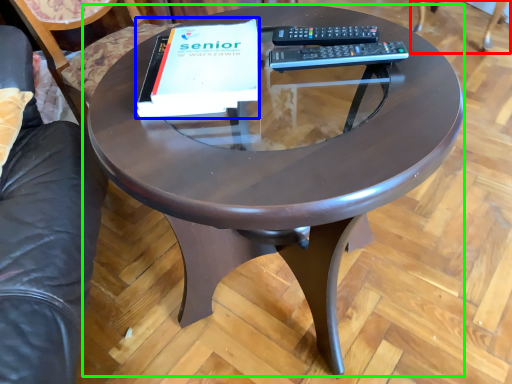
Question: Which is farther away from swivel chair (highlighted by a red box)? paperback book (highlighted by a blue box) or coffee table (highlighted by a green box)?

Choices:
 (A) paperback book
 (B) coffee table

Answer: (A)